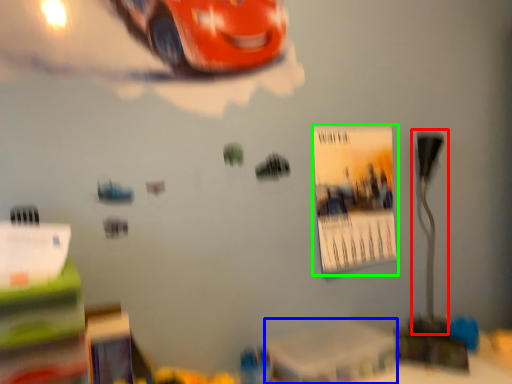
Question: Based on their relative distances, which object is farther from table lamp (highlighted by a red box)? Choose from table (highlighted by a blue box) and poster page (highlighted by a green box).

Choices:
 (A) table
 (B) poster page

Answer: (A)